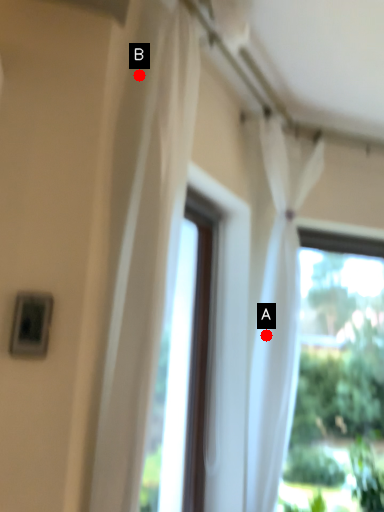
Question: Two points are circled on the image, labeled by A and B beside each circle. Which point is farther from the camera taking this photo?

Choices:
 (A) A is further
 (B) B is further

Answer: (A)